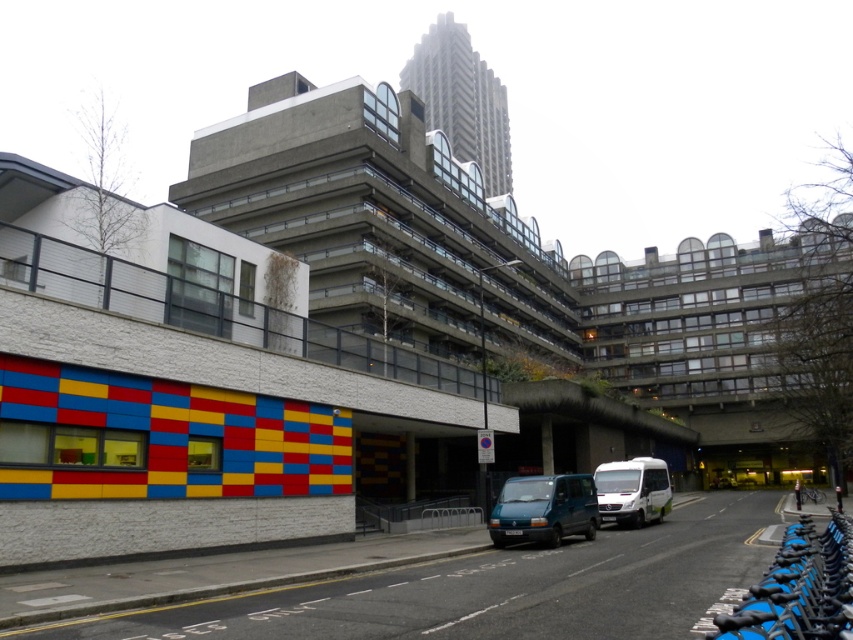
You are standing on the street looking at the buildings. There are two points marked on the buildings in the scene. One is at point (583, 509) and the other is at point (643, 468). Which of these points is closer to you?

Point (583, 509) is closer to the viewer than point (643, 468).